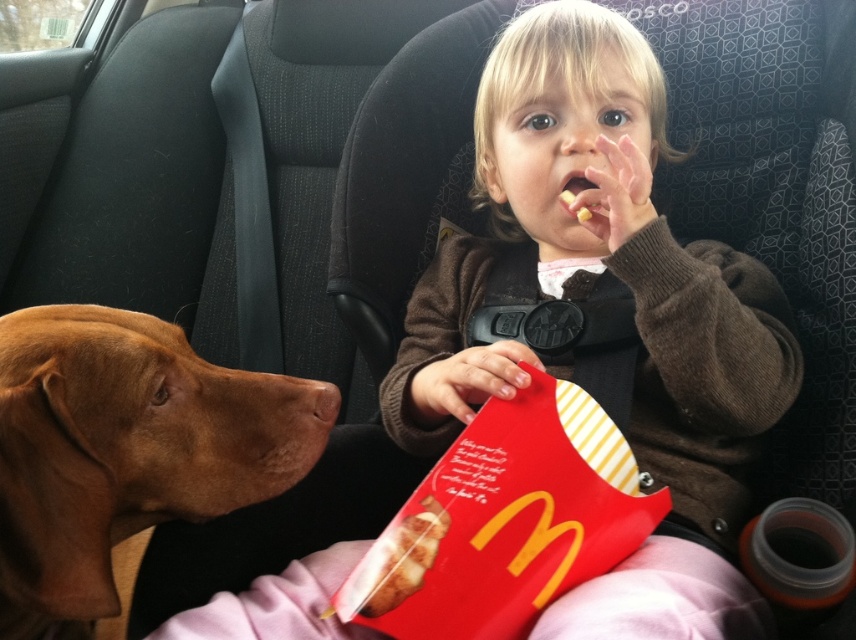
Between brown fur at left and yellow matte snack at center, which one appears on the right side from the viewer's perspective?

From the viewer's perspective, yellow matte snack at center appears more on the right side.

Who is shorter, brown fur at left or yellow matte snack at center?

Standing shorter between the two is yellow matte snack at center.

Locate an element on the screen. This screenshot has width=856, height=640. brown fur at left is located at coordinates (126, 449).

This screenshot has width=856, height=640. Identify the location of brown fur at left. (126, 449).